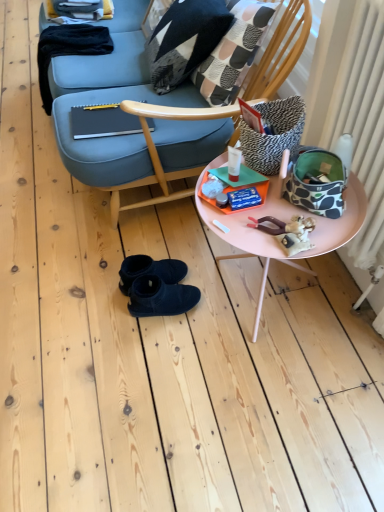
Question: From a real-world perspective, relative to black suede boots at center, is white textured radiator at right vertically above or below?

Choices:
 (A) below
 (B) above

Answer: (B)

Question: Looking at their shapes, would you say white textured radiator at right is wider or thinner than black suede boots at center?

Choices:
 (A) wide
 (B) thin

Answer: (B)

Question: Which of these objects is positioned closest to the pink plastic table at center?

Choices:
 (A) white textured radiator at right
 (B) zebra-patterned fabric pillow at upper right, positioned as the second pillow in left-to-right order
 (C) black suede boots at center
 (D) patchwork fabric throw pillow at upper center
 (E) black-and-white geometric-patterned pillow at upper center, marked as the first pillow in a back-to-front arrangement

Answer: (B)

Question: Considering the real-world distances, which object is farthest from the black suede boots at center?

Choices:
 (A) patchwork fabric throw pillow at upper center
 (B) black-and-white geometric-patterned pillow at upper center, which ranks as the second pillow in front-to-back order
 (C) pink plastic table at center
 (D) zebra-patterned fabric pillow at upper right, the 1th pillow positioned from the bottom
 (E) white textured radiator at right

Answer: (B)